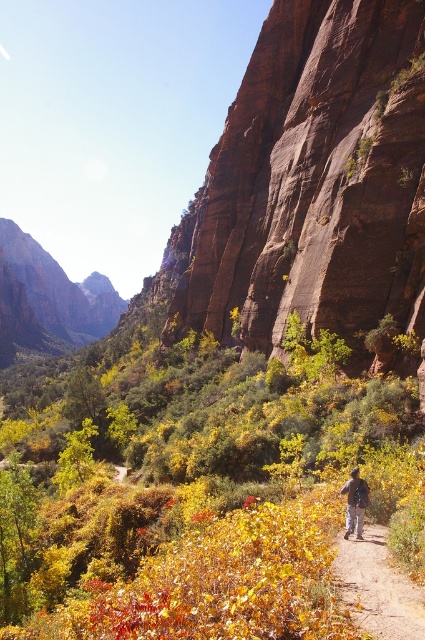
Question: Does dirt path at center have a greater width compared to dark blue jeans at center?

Choices:
 (A) no
 (B) yes

Answer: (B)

Question: Which point is farther from the camera taking this photo?

Choices:
 (A) (x=350, y=556)
 (B) (x=351, y=522)

Answer: (B)

Question: Which of the following is the farthest from the observer?

Choices:
 (A) (343, 595)
 (B) (362, 484)

Answer: (B)

Question: Is dirt path at center above dark blue jeans at center?

Choices:
 (A) yes
 (B) no

Answer: (B)

Question: Is dirt path at center to the right of dark blue jeans at center from the viewer's perspective?

Choices:
 (A) no
 (B) yes

Answer: (A)

Question: Among these objects, which one is farthest from the camera?

Choices:
 (A) dark blue jeans at center
 (B) dirt path at center

Answer: (A)